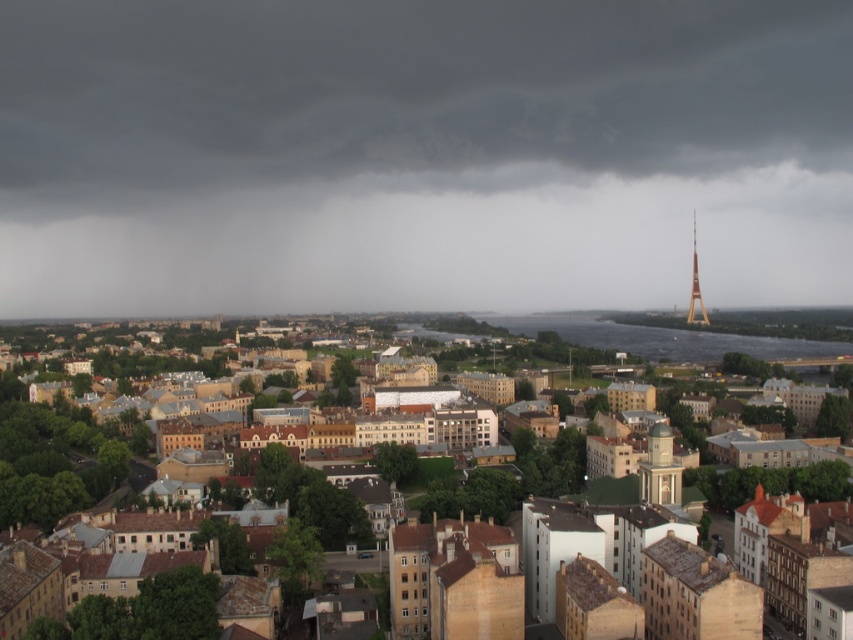
Question: Which of these objects is positioned farthest from the brown textured buildings at center?

Choices:
 (A) yellow metallic tower at right
 (B) dark gray cloud at upper center

Answer: (B)

Question: Is dark gray cloud at upper center below white marble clock tower at center?

Choices:
 (A) yes
 (B) no

Answer: (B)

Question: Which object is closer to the camera taking this photo?

Choices:
 (A) brown textured buildings at center
 (B) yellow metallic tower at right
 (C) dark gray cloud at upper center
 (D) white marble clock tower at center

Answer: (D)

Question: Is brown textured buildings at center positioned before yellow metallic tower at right?

Choices:
 (A) no
 (B) yes

Answer: (B)

Question: Does brown textured buildings at center appear under yellow metallic tower at right?

Choices:
 (A) no
 (B) yes

Answer: (B)

Question: Which object appears closest to the camera in this image?

Choices:
 (A) yellow metallic tower at right
 (B) dark gray cloud at upper center

Answer: (A)